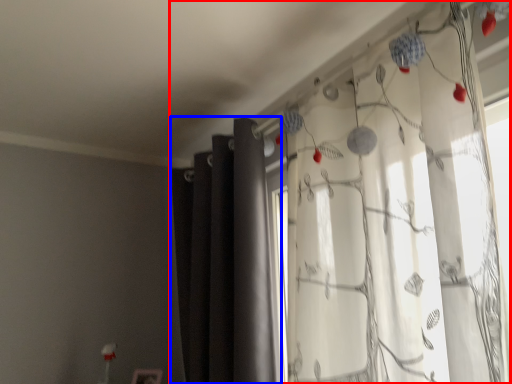
Question: Which object appears closest to the camera in this image, curtain (highlighted by a red box) or curtain (highlighted by a blue box)?

Choices:
 (A) curtain
 (B) curtain

Answer: (A)